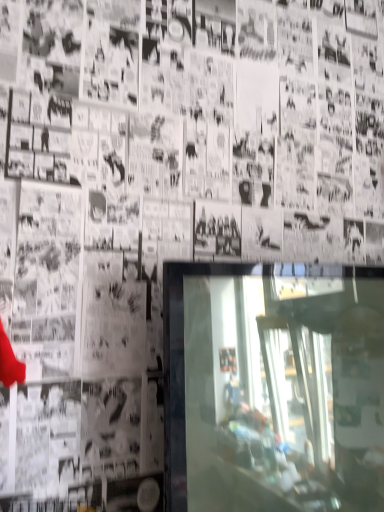
Question: Should I look upward or downward to see transparent glass tv at center?

Choices:
 (A) up
 (B) down

Answer: (B)